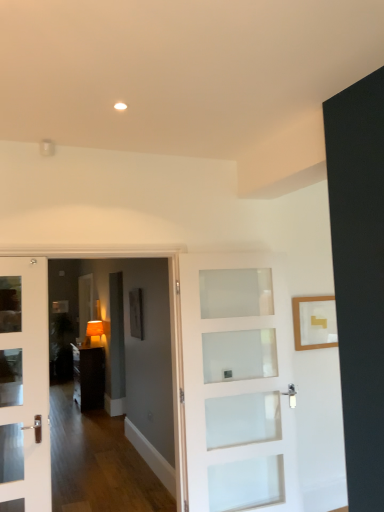
Describe the element at coordinates (136, 313) in the screenshot. I see `matte black picture frame at center, positioned as the 1th picture frame in left-to-right order` at that location.

Image resolution: width=384 pixels, height=512 pixels. What do you see at coordinates (94, 333) in the screenshot?
I see `matte orange lampshade at center` at bounding box center [94, 333].

Describe the element at coordinates (238, 389) in the screenshot. Image resolution: width=384 pixels, height=512 pixels. I see `white frosted glass door at center` at that location.

Identify the location of white frosted glass door at center. The height and width of the screenshot is (512, 384). (238, 389).

What is the approximate width of wooden picture frame at upper right, arranged as the second picture frame when viewed from the left?

It is 2.27 inches.

Identify the location of dark wood cabinet at center. (89, 377).

Where is `matte black picture frame at center, positioned as the 1th picture frame in left-to-right order`? The width and height of the screenshot is (384, 512). matte black picture frame at center, positioned as the 1th picture frame in left-to-right order is located at coordinates (136, 313).

Considering the sizes of objects dark wood cabinet at center and matte black picture frame at center, placed as the second picture frame when sorted from right to left, in the image provided, who is smaller, dark wood cabinet at center or matte black picture frame at center, placed as the second picture frame when sorted from right to left,?

With smaller size is matte black picture frame at center, placed as the second picture frame when sorted from right to left.

Could you measure the distance between dark wood cabinet at center and matte black picture frame at center, positioned as the 1th picture frame in left-to-right order?

dark wood cabinet at center is 1.98 meters from matte black picture frame at center, positioned as the 1th picture frame in left-to-right order.

Considering the points (94, 405) and (132, 303), which point is behind, point (94, 405) or point (132, 303)?

The point (94, 405) is behind.

From the image's perspective, is dark wood cabinet at center above matte black picture frame at center, placed as the second picture frame when sorted from right to left?

No, from the image's perspective, dark wood cabinet at center is not on top of matte black picture frame at center, placed as the second picture frame when sorted from right to left.

Does matte black picture frame at center, positioned as the 1th picture frame in left-to-right order, appear on the left side of white frosted glass door at center?

Indeed, matte black picture frame at center, positioned as the 1th picture frame in left-to-right order, is positioned on the left side of white frosted glass door at center.

Is matte black picture frame at center, the 1th picture frame when ordered from back to front, aimed at white frosted glass door at center?

No, matte black picture frame at center, the 1th picture frame when ordered from back to front, is not turned towards white frosted glass door at center.

From a real-world perspective, which object rests below the other?

white frosted glass door at center, from a real-world perspective.

Does matte black picture frame at center, arranged as the 2th picture frame when viewed from the front, lie behind white frosted glass door at center?

Yes, it is.

What are the coordinates of `picture frame that is the 1st object above the dark wood cabinet at center (from a real-world perspective)` in the screenshot? It's located at (314, 322).

From a real-world perspective, is wooden picture frame at upper right, which is counted as the 1th picture frame, starting from the right, beneath dark wood cabinet at center?

Incorrect, from a real-world perspective, wooden picture frame at upper right, which is counted as the 1th picture frame, starting from the right, is higher than dark wood cabinet at center.

How many degrees apart are the facing directions of wooden picture frame at upper right, arranged as the second picture frame when viewed from the left, and dark wood cabinet at center?

The angular difference between wooden picture frame at upper right, arranged as the second picture frame when viewed from the left, and dark wood cabinet at center is 89.7 degrees.

Measure the distance from wooden picture frame at upper right, acting as the first picture frame starting from the front, to dark wood cabinet at center.

wooden picture frame at upper right, acting as the first picture frame starting from the front, is 3.96 meters away from dark wood cabinet at center.

Could you tell me if dark wood cabinet at center is facing white frosted glass door at center?

No, dark wood cabinet at center is not oriented towards white frosted glass door at center.

Is dark wood cabinet at center inside the boundaries of white frosted glass door at center, or outside?

dark wood cabinet at center exists outside the volume of white frosted glass door at center.

Is dark wood cabinet at center not close to white frosted glass door at center?

Indeed, dark wood cabinet at center is not near white frosted glass door at center.

Is dark wood cabinet at center behind white frosted glass door at center?

Yes, the depth of dark wood cabinet at center is greater than that of white frosted glass door at center.

Is matte orange lampshade at center at the back of dark wood cabinet at center?

No, dark wood cabinet at center is not facing away from matte orange lampshade at center.

Does dark wood cabinet at center have a smaller size compared to matte orange lampshade at center?

Incorrect, dark wood cabinet at center is not smaller in size than matte orange lampshade at center.

Can we say dark wood cabinet at center lies outside matte orange lampshade at center?

Yes, dark wood cabinet at center is outside of matte orange lampshade at center.

Is dark wood cabinet at center far away from matte orange lampshade at center?

dark wood cabinet at center is actually quite close to matte orange lampshade at center.

Is point (272, 268) closer or farther from the camera than point (140, 324)?

Point (272, 268) appears to be closer to the viewer than point (140, 324).

Are white frosted glass door at center and matte black picture frame at center, arranged as the 2th picture frame when viewed from the front, far apart?

white frosted glass door at center is positioned a significant distance from matte black picture frame at center, arranged as the 2th picture frame when viewed from the front.

Is white frosted glass door at center in front of or behind matte black picture frame at center, the 1th picture frame when ordered from back to front, in the image?

In the image, white frosted glass door at center appears in front of matte black picture frame at center, the 1th picture frame when ordered from back to front.

In the image, is white frosted glass door at center on the left side or the right side of matte black picture frame at center, the 1th picture frame when ordered from back to front?

white frosted glass door at center is positioned on matte black picture frame at center, the 1th picture frame when ordered from back to front,'s right side.

How far apart are white frosted glass door at center and matte orange lampshade at center?

white frosted glass door at center and matte orange lampshade at center are 4.00 meters apart.

How many degrees apart are the facing directions of white frosted glass door at center and matte orange lampshade at center?

The angle between the facing direction of white frosted glass door at center and the facing direction of matte orange lampshade at center is 76.2 degrees.

Is the position of white frosted glass door at center more distant than that of matte orange lampshade at center?

That is False.

Considering the sizes of objects white frosted glass door at center and matte orange lampshade at center in the image provided, who is smaller, white frosted glass door at center or matte orange lampshade at center?

matte orange lampshade at center.

You are a GUI agent. You are given a task and a screenshot of the screen. Output one action in this format:
    pyautogui.click(x=<x>, y=<y>)
    Task: Click on the furniture on the left of matte black picture frame at center, the 1th picture frame when ordered from back to front
    
    Given the screenshot: What is the action you would take?
    pyautogui.click(x=89, y=377)

The width and height of the screenshot is (384, 512). I want to click on door below the matte black picture frame at center, positioned as the 1th picture frame in left-to-right order (from a real-world perspective), so click(238, 389).

Looking at the image, which one is located closer to matte black picture frame at center, positioned as the 1th picture frame in left-to-right order, dark wood cabinet at center or white frosted glass door at center?

white frosted glass door at center is closer to matte black picture frame at center, positioned as the 1th picture frame in left-to-right order.

Estimate the real-world distances between objects in this image. Which object is closer to wooden picture frame at upper right, the 2th picture frame when ordered from back to front, matte orange lampshade at center or matte black picture frame at center, the 1th picture frame when ordered from back to front?

The object closer to wooden picture frame at upper right, the 2th picture frame when ordered from back to front, is matte black picture frame at center, the 1th picture frame when ordered from back to front.

Consider the image. From the image, which object appears to be nearer to wooden picture frame at upper right, acting as the first picture frame starting from the front, dark wood cabinet at center or white frosted glass door at center?

Among the two, white frosted glass door at center is located nearer to wooden picture frame at upper right, acting as the first picture frame starting from the front.

Which object lies nearer to the anchor point white frosted glass door at center, dark wood cabinet at center or matte orange lampshade at center?

dark wood cabinet at center is positioned closer to the anchor white frosted glass door at center.

Consider the image. When comparing their distances from white frosted glass door at center, does dark wood cabinet at center or matte black picture frame at center, arranged as the 2th picture frame when viewed from the front, seem closer?

The object closer to white frosted glass door at center is matte black picture frame at center, arranged as the 2th picture frame when viewed from the front.

Which object lies nearer to the anchor point matte black picture frame at center, the 1th picture frame when ordered from back to front, white frosted glass door at center or wooden picture frame at upper right, the 2th picture frame when ordered from back to front?

Among the two, white frosted glass door at center is located nearer to matte black picture frame at center, the 1th picture frame when ordered from back to front.

Estimate the real-world distances between objects in this image. Which object is closer to wooden picture frame at upper right, arranged as the second picture frame when viewed from the left, matte black picture frame at center, positioned as the 1th picture frame in left-to-right order, or white frosted glass door at center?

white frosted glass door at center lies closer to wooden picture frame at upper right, arranged as the second picture frame when viewed from the left, than the other object.

Estimate the real-world distances between objects in this image. Which object is further from dark wood cabinet at center, matte orange lampshade at center or white frosted glass door at center?

white frosted glass door at center.

At what (x,y) coordinates should I click in order to perform the action: click on furniture located between wooden picture frame at upper right, arranged as the second picture frame when viewed from the left, and matte orange lampshade at center in the depth direction. Please return your answer as a coordinate pair (x, y). This screenshot has height=512, width=384. Looking at the image, I should click on (89, 377).

The height and width of the screenshot is (512, 384). I want to click on furniture between matte black picture frame at center, arranged as the 2th picture frame when viewed from the front, and matte orange lampshade at center, along the z-axis, so click(x=89, y=377).

Image resolution: width=384 pixels, height=512 pixels. What are the coordinates of `furniture located between white frosted glass door at center and matte orange lampshade at center in the depth direction` in the screenshot? It's located at point(89,377).

Locate an element on the screen. picture frame located between wooden picture frame at upper right, acting as the first picture frame starting from the front, and dark wood cabinet at center in the depth direction is located at coordinates (136, 313).